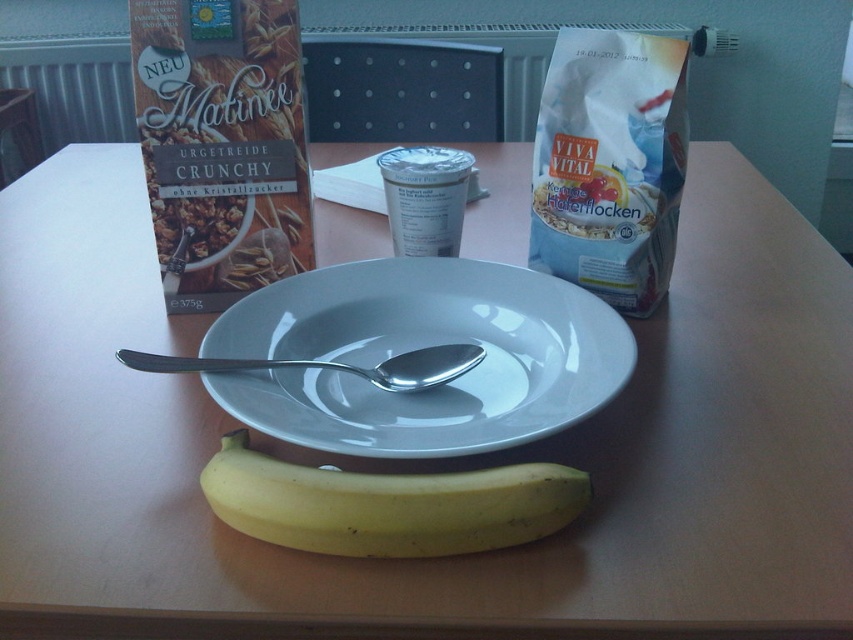
You are a chef preparing breakfast and need to place a garnish on the white matte yogurt cup at center. Since the silver metallic spoon at center is in the way, can you move the spoon to the right to make space? Explain why or why not based on their positions.

The white matte yogurt cup at center is located above the silver metallic spoon at center. Moving the spoon to the right would not interfere with the yogurt cup since they are vertically aligned. However, you can move the spoon to the right to create space as they are separate horizontally.

You are a delivery robot with a 16 inch arm. You need to pick up the white paper bag at upper right. Can your arm reach it?

The white paper bag at upper right is 18.58 inches away from camera. Since the robot arm is 16 inches, it cannot reach the white paper bag at upper right.

You are preparing breakfast and need to choose a container to hold more yogurt. You have a white matte yogurt cup at center and a silver metallic spoon at center. Which one can hold more yogurt?

The white matte yogurt cup at center is bigger than the silver metallic spoon at center, so it can hold more yogurt.